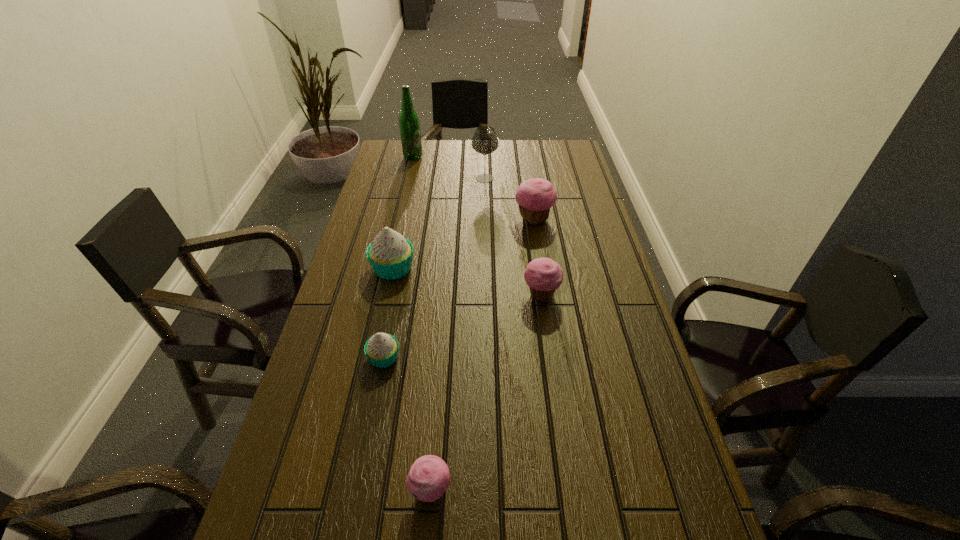
Locate an element on the screen. pink cupcake that is the second closest to the fifth nearest object is located at coordinates (429, 477).

Select which white cupcake is the closest to the biggest pink cupcake. Please provide its 2D coordinates. Your answer should be formatted as a tuple, i.e. [(x, y)], where the tuple contains the x and y coordinates of a point satisfying the conditions above.

[(390, 255)]

Select which white cupcake appears as the closest to the beer bottle. Please provide its 2D coordinates. Your answer should be formatted as a tuple, i.e. [(x, y)], where the tuple contains the x and y coordinates of a point satisfying the conditions above.

[(390, 255)]

Where is `vacant area that satisfies the following two spatial constraints: 1. on the label of the fourth object from right to left; 2. on the left side of the beer bottle`? The image size is (960, 540). vacant area that satisfies the following two spatial constraints: 1. on the label of the fourth object from right to left; 2. on the left side of the beer bottle is located at coordinates pos(337,491).

Where is `free point that satisfies the following two spatial constraints: 1. on the front side of the farther white cupcake; 2. on the left side of the nearest pink cupcake`? The width and height of the screenshot is (960, 540). free point that satisfies the following two spatial constraints: 1. on the front side of the farther white cupcake; 2. on the left side of the nearest pink cupcake is located at coordinates (346, 491).

This screenshot has height=540, width=960. I want to click on vacant space that satisfies the following two spatial constraints: 1. on the back side of the farthest pink cupcake; 2. on the label of the farthest object, so [524, 157].

The width and height of the screenshot is (960, 540). In order to click on vacant area in the image that satisfies the following two spatial constraints: 1. on the label of the farthest cupcake; 2. on the left side of the farthest object in this screenshot , I will do `click(398, 220)`.